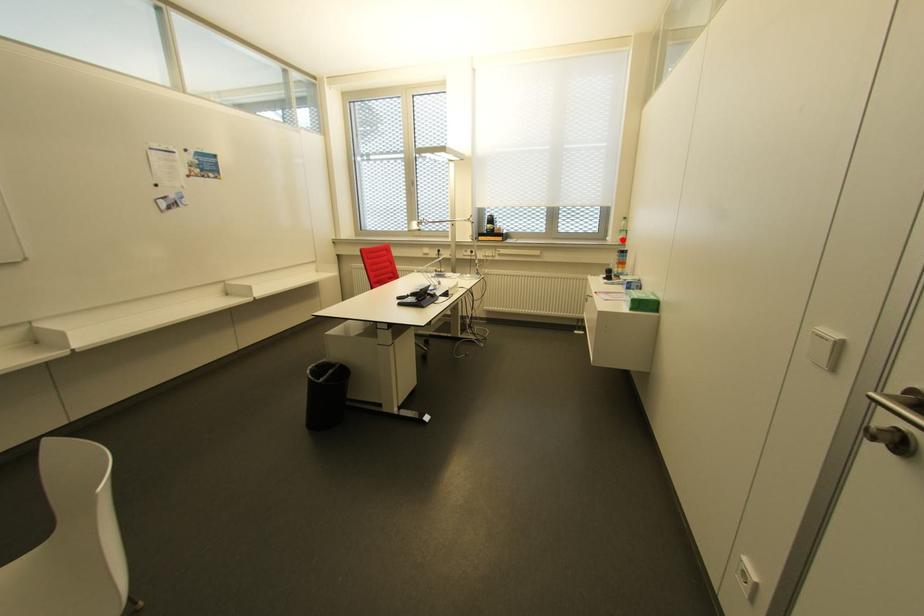
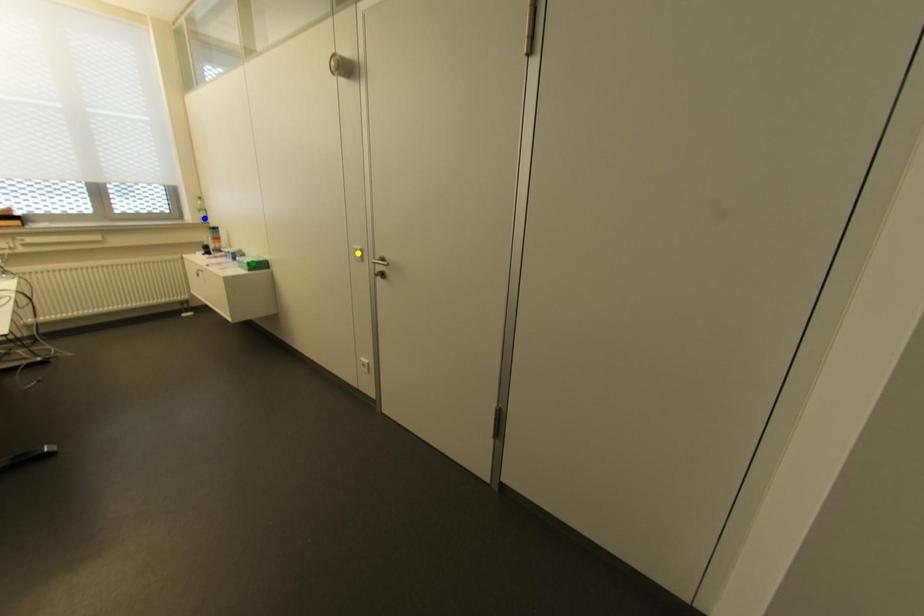
Question: I am providing you with two images of the same scene from different viewpoints. A red point is marked on the first image. You are given multiple points on the second image. Which spot in image 2 lines up with the point in image 1?

Choices:
 (A) blue point
 (B) yellow point
 (C) green point

Answer: (A)